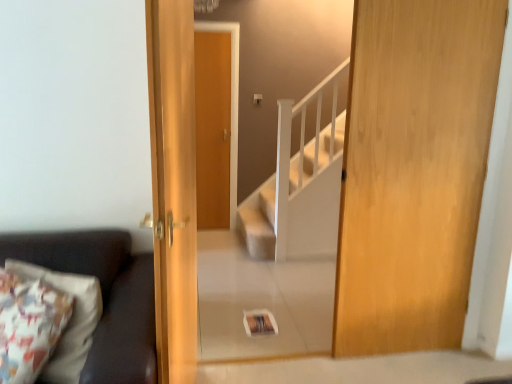
Measure the distance between wooden door at center, acting as the 2th door starting from the right, and camera.

wooden door at center, acting as the 2th door starting from the right, and camera are 3.67 feet apart.

Find the location of a particular element. dark brown leather couch at left is located at coordinates (103, 297).

Which object is thinner, dark brown leather couch at left or wooden door at right, positioned as the first door in right-to-left order?

wooden door at right, positioned as the first door in right-to-left order, is thinner.

Consider the image. Between dark brown leather couch at left and wooden door at right, which is counted as the second door, starting from the left, which one appears on the right side from the viewer's perspective?

Positioned to the right is wooden door at right, which is counted as the second door, starting from the left.

How many degrees apart are the facing directions of dark brown leather couch at left and wooden door at right, positioned as the first door in right-to-left order?

dark brown leather couch at left and wooden door at right, positioned as the first door in right-to-left order, are facing 0.179 degrees away from each other.

Could you tell me if dark brown leather couch at left is facing wooden door at right, which is counted as the second door, starting from the left?

No, dark brown leather couch at left is not turned towards wooden door at right, which is counted as the second door, starting from the left.

From the image's perspective, which one is positioned lower, wooden door at right, positioned as the first door in right-to-left order, or dark brown leather couch at left?

dark brown leather couch at left, from the image's perspective.

Does point (445, 288) appear closer or farther from the camera than point (110, 353)?

Point (445, 288) appears to be farther away from the viewer than point (110, 353).

Is wooden door at right, which is counted as the second door, starting from the left, positioned before dark brown leather couch at left?

No.

Which object is closer to the camera, wooden door at right, which is counted as the second door, starting from the left, or wooden door at center, which is the first door from left to right?

wooden door at center, which is the first door from left to right, is closer to the camera.

From a real-world perspective, is wooden door at right, which is counted as the second door, starting from the left, under wooden door at center, which is the first door from left to right?

No, from a real-world perspective, wooden door at right, which is counted as the second door, starting from the left, is not beneath wooden door at center, which is the first door from left to right.

Consider the image. Can you tell me how much wooden door at right, which is counted as the second door, starting from the left, and wooden door at center, which is the first door from left to right, differ in facing direction?

wooden door at right, which is counted as the second door, starting from the left, and wooden door at center, which is the first door from left to right, are facing 81.4 degrees away from each other.

In the scene shown: Is wooden door at right, which is counted as the second door, starting from the left, not within wooden door at center, acting as the 2th door starting from the right?

Yes, wooden door at right, which is counted as the second door, starting from the left, is outside of wooden door at center, acting as the 2th door starting from the right.

Can you see wooden door at center, acting as the 2th door starting from the right, touching dark brown leather couch at left?

No.

From a real-world perspective, relative to dark brown leather couch at left, is wooden door at center, acting as the 2th door starting from the right, vertically above or below?

wooden door at center, acting as the 2th door starting from the right, is above dark brown leather couch at left.

From the image's perspective, who appears lower, wooden door at center, which is the first door from left to right, or dark brown leather couch at left?

From the image's view, dark brown leather couch at left is below.

Looking at this image, is wooden door at center, acting as the 2th door starting from the right, taller than dark brown leather couch at left?

Correct, wooden door at center, acting as the 2th door starting from the right, is much taller as dark brown leather couch at left.

From the image's perspective, which is below, wooden door at center, which is the first door from left to right, or wooden door at right, which is counted as the second door, starting from the left?

From the image's view, wooden door at center, which is the first door from left to right, is below.

Is wooden door at center, which is the first door from left to right, shorter than wooden door at right, positioned as the first door in right-to-left order?

Yes.

Is wooden door at center, which is the first door from left to right, positioned with its back to wooden door at right, positioned as the first door in right-to-left order?

No, wooden door at center, which is the first door from left to right, is not facing the opposite direction of wooden door at right, positioned as the first door in right-to-left order.

Measure the distance from dark brown leather couch at left to wooden door at center, which is the first door from left to right.

dark brown leather couch at left and wooden door at center, which is the first door from left to right, are 14.75 inches apart from each other.

Are dark brown leather couch at left and wooden door at center, which is the first door from left to right, making contact?

No, dark brown leather couch at left is not with wooden door at center, which is the first door from left to right.

Could you tell me if dark brown leather couch at left is turned towards wooden door at center, acting as the 2th door starting from the right?

No, dark brown leather couch at left is not turned towards wooden door at center, acting as the 2th door starting from the right.

Between dark brown leather couch at left and wooden door at center, acting as the 2th door starting from the right, which one has smaller width?

Thinner between the two is wooden door at center, acting as the 2th door starting from the right.

This screenshot has height=384, width=512. Find the location of `studio couch directly beneath the wooden door at right, positioned as the first door in right-to-left order (from a real-world perspective)`. studio couch directly beneath the wooden door at right, positioned as the first door in right-to-left order (from a real-world perspective) is located at coordinates (103, 297).

Locate an element on the screen. The height and width of the screenshot is (384, 512). studio couch on the left of wooden door at right, positioned as the first door in right-to-left order is located at coordinates (103, 297).

From the image, which object appears to be nearer to wooden door at center, which is the first door from left to right, dark brown leather couch at left or wooden door at right, which is counted as the second door, starting from the left?

The object closer to wooden door at center, which is the first door from left to right, is dark brown leather couch at left.

Considering their positions, is wooden door at right, positioned as the first door in right-to-left order, positioned closer to dark brown leather couch at left than wooden door at center, which is the first door from left to right?

wooden door at center, which is the first door from left to right.

Which object lies further to the anchor point wooden door at center, which is the first door from left to right, wooden door at right, positioned as the first door in right-to-left order, or dark brown leather couch at left?

wooden door at right, positioned as the first door in right-to-left order, is further to wooden door at center, which is the first door from left to right.

From the image, which object appears to be nearer to wooden door at right, which is counted as the second door, starting from the left, wooden door at center, acting as the 2th door starting from the right, or dark brown leather couch at left?

Based on the image, wooden door at center, acting as the 2th door starting from the right, appears to be nearer to wooden door at right, which is counted as the second door, starting from the left.

Based on their spatial positions, is wooden door at center, acting as the 2th door starting from the right, or wooden door at right, which is counted as the second door, starting from the left, closer to dark brown leather couch at left?

wooden door at center, acting as the 2th door starting from the right, is positioned closer to the anchor dark brown leather couch at left.

Based on their spatial positions, is dark brown leather couch at left or wooden door at center, acting as the 2th door starting from the right, further from wooden door at right, which is counted as the second door, starting from the left?

dark brown leather couch at left lies further to wooden door at right, which is counted as the second door, starting from the left, than the other object.

Locate an element on the screen. The image size is (512, 384). door situated between dark brown leather couch at left and wooden door at right, positioned as the first door in right-to-left order, from left to right is located at coordinates (173, 185).